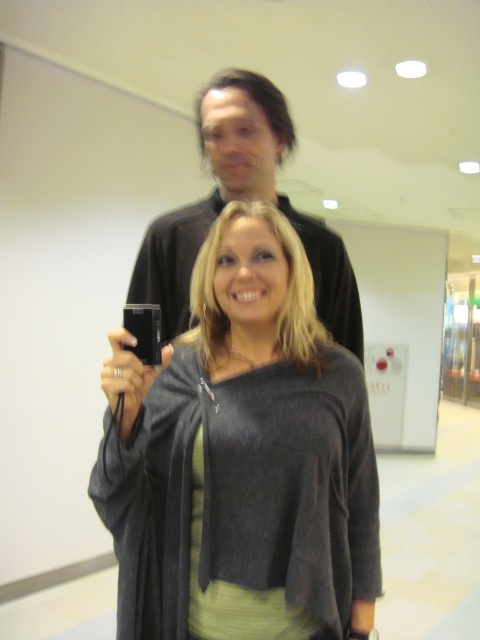
Can you confirm if matte black camera at center is taller than black matte camera at upper center?

Yes.

Between matte black camera at center and black matte camera at upper center, which one appears on the left side from the viewer's perspective?

From the viewer's perspective, matte black camera at center appears more on the left side.

Is point (348, 552) positioned behind point (215, 209)?

No, it is not.

This screenshot has width=480, height=640. What are the coordinates of `matte black camera at center` in the screenshot? It's located at (242, 458).